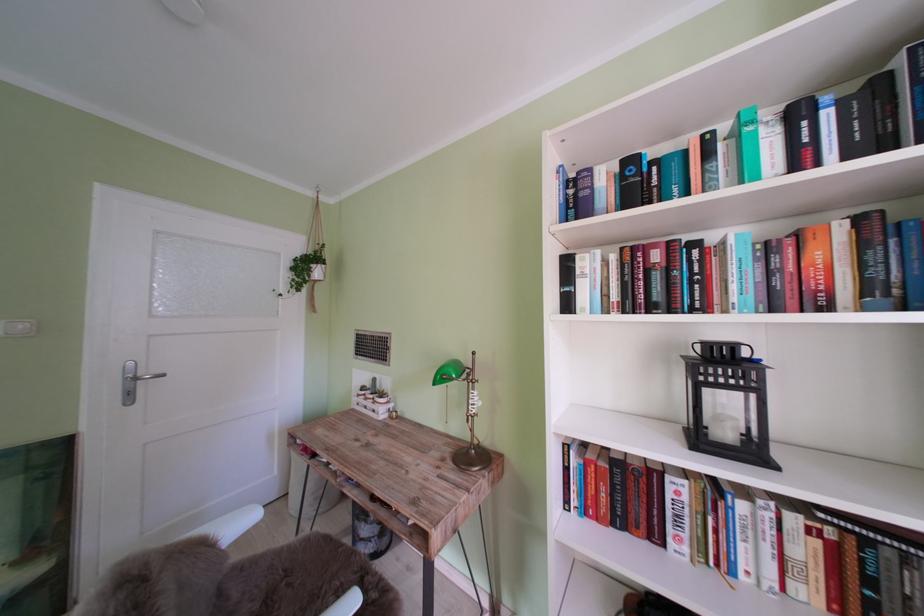
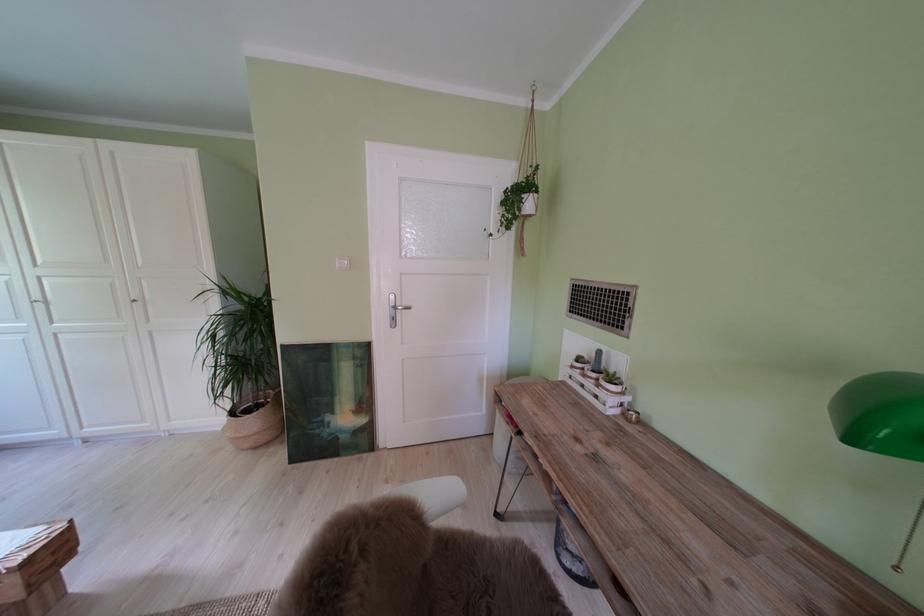
In the second image, find the point that corresponds to point 383,402 in the first image.

(604, 381)